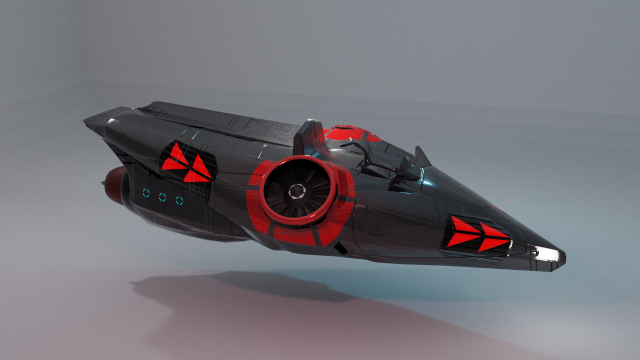
This screenshot has height=360, width=640. Find the location of `vent`. vent is located at coordinates (312, 192).